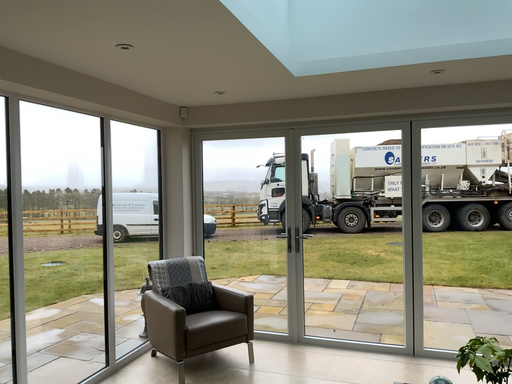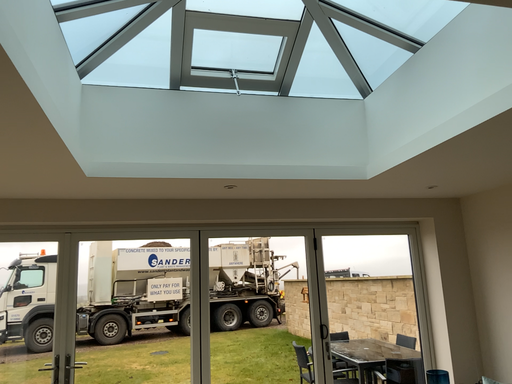
Question: Which way did the camera rotate in the video?

Choices:
 (A) rotated downward
 (B) rotated upward

Answer: (B)